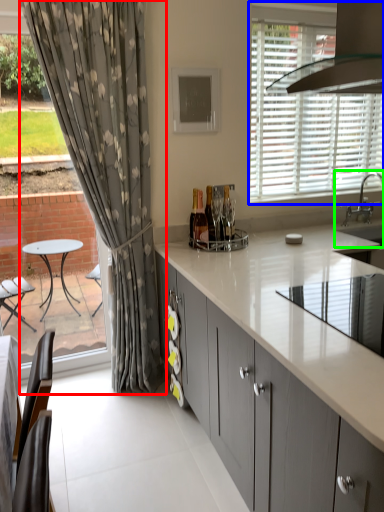
Question: Which is farther away from curtain (highlighted by a red box)? window (highlighted by a blue box) or sink (highlighted by a green box)?

Choices:
 (A) window
 (B) sink

Answer: (B)